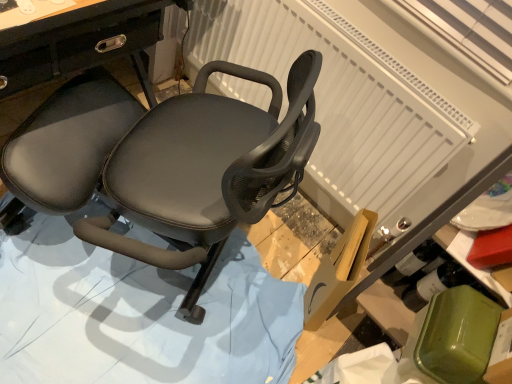
Question: Can you confirm if black leather chair at center is bigger than matte black chair at center?

Choices:
 (A) yes
 (B) no

Answer: (B)

Question: From a real-world perspective, is black leather chair at center beneath matte black chair at center?

Choices:
 (A) no
 (B) yes

Answer: (B)

Question: Is black leather chair at center wider than matte black chair at center?

Choices:
 (A) no
 (B) yes

Answer: (B)

Question: Does black leather chair at center have a lesser width compared to matte black chair at center?

Choices:
 (A) yes
 (B) no

Answer: (B)

Question: From the image's perspective, is black leather chair at center located beneath matte black chair at center?

Choices:
 (A) no
 (B) yes

Answer: (B)

Question: Is black leather chair at center closer to camera compared to matte black chair at center?

Choices:
 (A) no
 (B) yes

Answer: (A)

Question: Is white textured radiator at upper center closer to the viewer compared to black leather chair at center?

Choices:
 (A) no
 (B) yes

Answer: (A)

Question: Is white textured radiator at upper center beside black leather chair at center?

Choices:
 (A) no
 (B) yes

Answer: (A)

Question: Is white textured radiator at upper center outside of black leather chair at center?

Choices:
 (A) no
 (B) yes

Answer: (B)

Question: Is white textured radiator at upper center taller than black leather chair at center?

Choices:
 (A) yes
 (B) no

Answer: (A)

Question: Is white textured radiator at upper center to the left of black leather chair at center from the viewer's perspective?

Choices:
 (A) yes
 (B) no

Answer: (B)

Question: Is white textured radiator at upper center aimed at black leather chair at center?

Choices:
 (A) no
 (B) yes

Answer: (B)

Question: Is matte black chair at center taller than black leather chair at center?

Choices:
 (A) yes
 (B) no

Answer: (A)